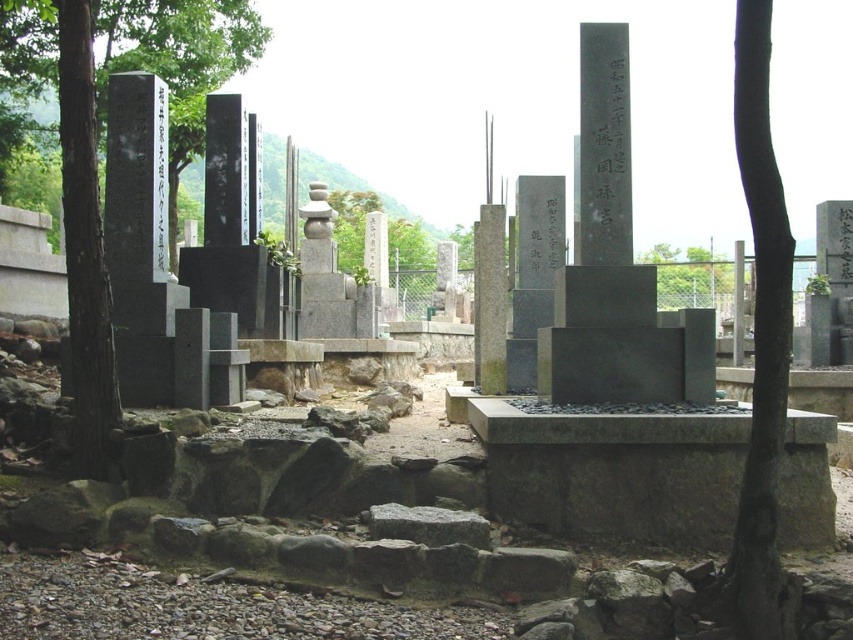
Question: Which point is farther to the camera?

Choices:
 (A) (477, 252)
 (B) (4, 22)
 (C) (206, 136)

Answer: (B)

Question: Among these objects, which one is farthest from the camera?

Choices:
 (A) green leafy tree at left
 (B) green leafy tree at center
 (C) gray polished stone pillar at center

Answer: (C)

Question: Observing the image, what is the correct spatial positioning of dark brown bark at center in reference to gray polished stone pillar at center?

Choices:
 (A) below
 (B) above

Answer: (A)

Question: Which of these objects is positioned farthest from the gray polished stone pillar at center?

Choices:
 (A) black polished stone pillar at center
 (B) green leafy tree at left
 (C) dark brown bark at center
 (D) black polished stone marker at center

Answer: (B)

Question: Is black polished stone marker at center to the left of black polished stone pillar at center from the viewer's perspective?

Choices:
 (A) no
 (B) yes

Answer: (A)

Question: Can you confirm if green leafy tree at left is positioned above black polished stone pillar at center?

Choices:
 (A) yes
 (B) no

Answer: (A)